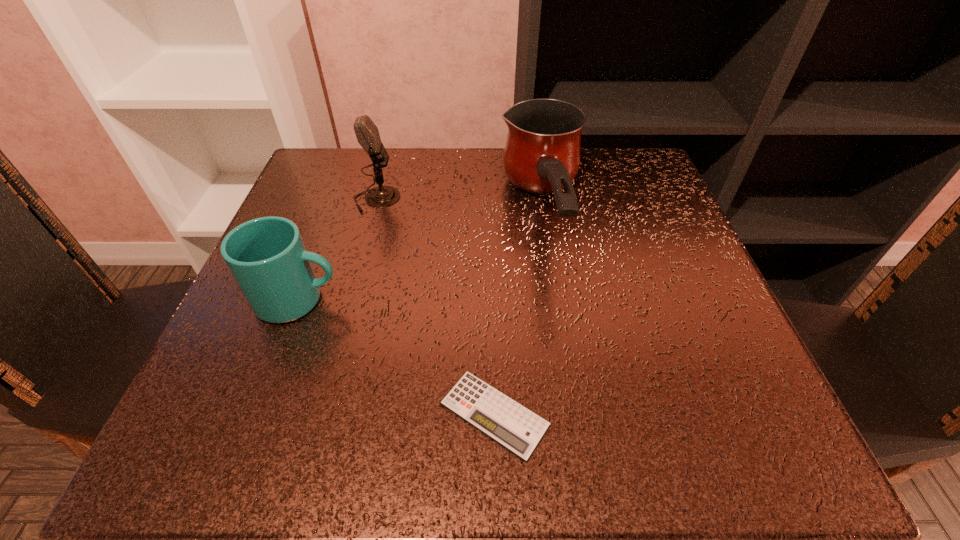
At what (x,y) coordinates should I click in order to perform the action: click on vacant area between the saucepan and the microphone. Please return your answer as a coordinate pair (x, y). This screenshot has width=960, height=540. Looking at the image, I should click on (460, 206).

Point out which object is positioned as the second nearest to the microphone. Please provide its 2D coordinates. Your answer should be formatted as a tuple, i.e. [(x, y)], where the tuple contains the x and y coordinates of a point satisfying the conditions above.

[(542, 154)]

Locate an element on the screen. This screenshot has height=540, width=960. object that ranks as the third closest to the microphone is located at coordinates (516, 428).

The image size is (960, 540). I want to click on free region that satisfies the following two spatial constraints: 1. on the handle side of the saucepan; 2. on the handle side of the second shortest object, so click(x=557, y=300).

Find the location of a particular element. vacant space that satisfies the following two spatial constraints: 1. on the handle side of the shortest object; 2. on the left side of the cup is located at coordinates (256, 414).

Find the location of `free space that satisfies the following two spatial constraints: 1. on the front-facing side of the shortest object; 2. on the right side of the microphone`. free space that satisfies the following two spatial constraints: 1. on the front-facing side of the shortest object; 2. on the right side of the microphone is located at coordinates (319, 414).

This screenshot has width=960, height=540. Identify the location of blank space that satisfies the following two spatial constraints: 1. on the handle side of the second shortest object; 2. on the left side of the nearest object. (256, 414).

The image size is (960, 540). I want to click on free space in the image that satisfies the following two spatial constraints: 1. on the front-facing side of the shortest object; 2. on the right side of the microphone, so click(319, 414).

Identify the location of vacant space that satisfies the following two spatial constraints: 1. on the handle side of the calculator; 2. on the left side of the third tallest object. (256, 414).